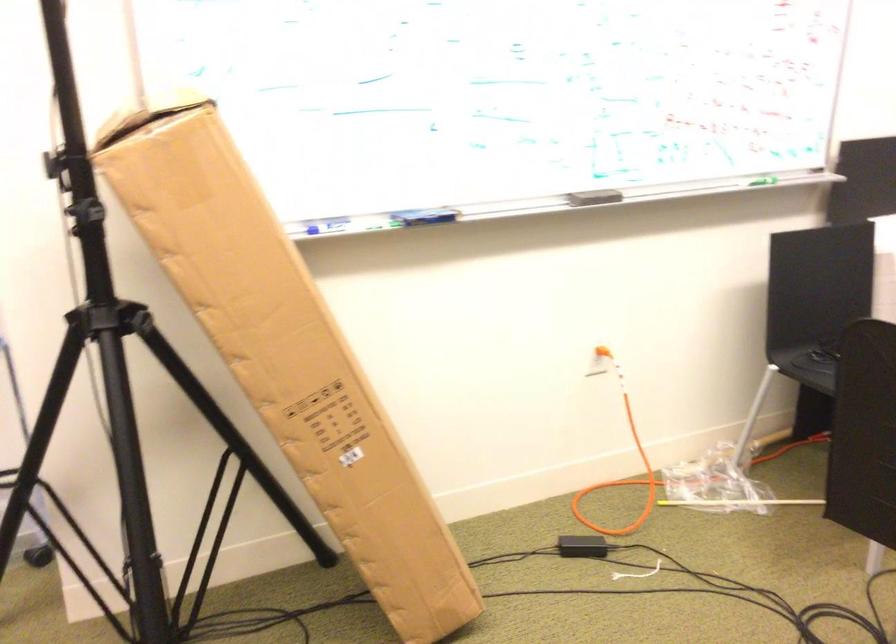
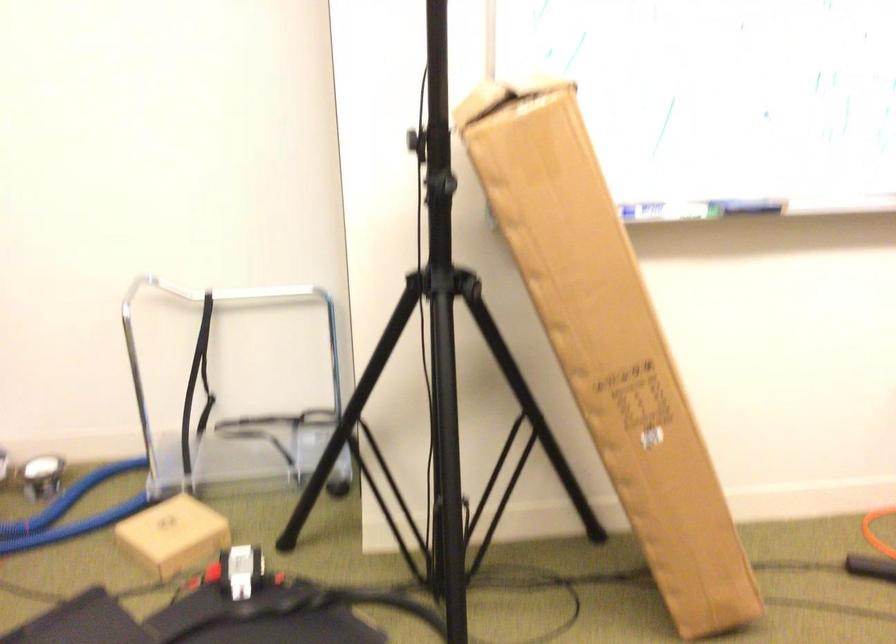
Based on the photo, what movement of the cameraman would produce the second image?

The cameraman walked toward left, backward.